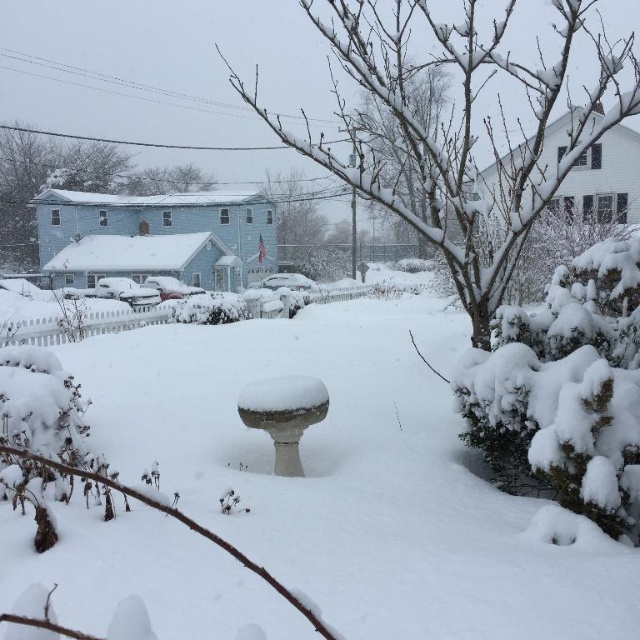
Can you confirm if white matte snow at center is wider than snow-covered tree at center?

In fact, white matte snow at center might be narrower than snow-covered tree at center.

Can you confirm if white matte snow at center is bigger than snow-covered tree at center?

Actually, white matte snow at center might be smaller than snow-covered tree at center.

Does point (460, 508) come behind point (499, 186)?

No, it is not.

Where is `white matte snow at center`? The height and width of the screenshot is (640, 640). white matte snow at center is located at coordinates (355, 476).

Between snow-covered tree at center and smooth blue house at left, which one appears on the right side from the viewer's perspective?

Positioned to the right is snow-covered tree at center.

From the picture: Between snow-covered tree at center and smooth blue house at left, which one is positioned lower?

snow-covered tree at center is below.

What do you see at coordinates (452, 131) in the screenshot? I see `snow-covered tree at center` at bounding box center [452, 131].

You are a GUI agent. You are given a task and a screenshot of the screen. Output one action in this format:
    pyautogui.click(x=<x>, y=<y>)
    Task: Click on the snow-covered tree at center
    Image resolution: width=640 pixels, height=640 pixels.
    Given the screenshot: What is the action you would take?
    pyautogui.click(x=452, y=131)

Consider the image. Is snow-covered tree at center to the right of snow-covered tree at upper center from the viewer's perspective?

Yes, snow-covered tree at center is to the right of snow-covered tree at upper center.

Where is `snow-covered tree at center`? The width and height of the screenshot is (640, 640). snow-covered tree at center is located at coordinates (452, 131).

Between point (470, 157) and point (129, 177), which one is positioned behind?

The point (129, 177) is behind.

Where is `snow-covered tree at center`? The height and width of the screenshot is (640, 640). snow-covered tree at center is located at coordinates (452, 131).